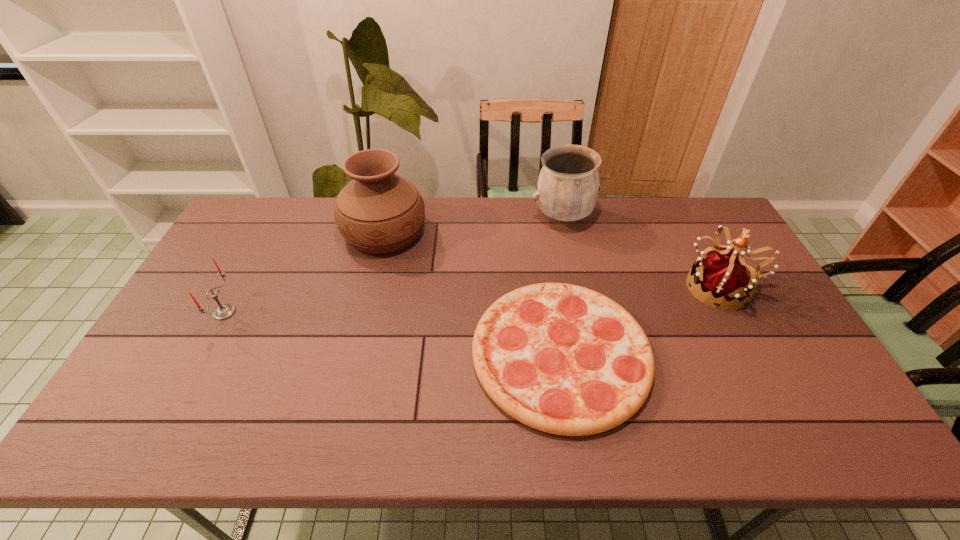
The width and height of the screenshot is (960, 540). Find the location of `the left urn`. the left urn is located at coordinates (378, 211).

What are the coordinates of `the right urn` in the screenshot? It's located at (568, 184).

Image resolution: width=960 pixels, height=540 pixels. Find the location of `tiara`. tiara is located at coordinates (723, 275).

The width and height of the screenshot is (960, 540). I want to click on the leftmost object, so click(x=224, y=311).

Where is `the fourth tallest object`? the fourth tallest object is located at coordinates (224, 311).

Identify the location of pizza. Image resolution: width=960 pixels, height=540 pixels. (563, 359).

Locate an element on the screen. The image size is (960, 540). free space located on the left of the left urn is located at coordinates (257, 232).

Where is `free region located on the right of the right urn`? Image resolution: width=960 pixels, height=540 pixels. free region located on the right of the right urn is located at coordinates (689, 218).

The width and height of the screenshot is (960, 540). I want to click on free space located 0.180m on the front-facing side of the tiara, so click(x=625, y=287).

You are a GUI agent. You are given a task and a screenshot of the screen. Output one action in this format:
    pyautogui.click(x=<x>, y=<y>)
    Task: Click on the free space located 0.320m on the front-facing side of the tiara
    The width and height of the screenshot is (960, 540).
    Given the screenshot: What is the action you would take?
    pyautogui.click(x=578, y=287)